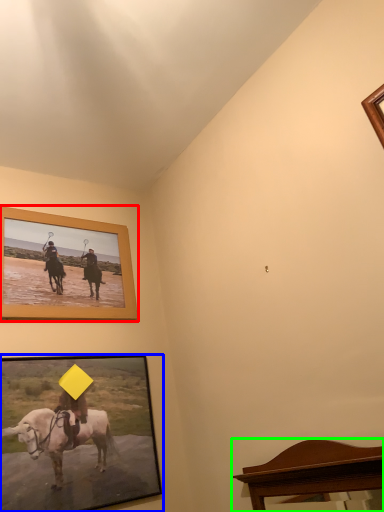
Question: Which object is positioned closest to picture frame (highlighted by a red box)? Select from picture frame (highlighted by a blue box) and furniture (highlighted by a green box).

Choices:
 (A) picture frame
 (B) furniture

Answer: (A)